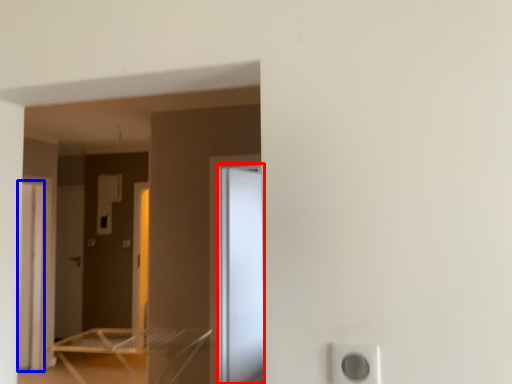
Question: Which of the following is the farthest to the observer, screen door (highlighted by a red box) or screen door (highlighted by a blue box)?

Choices:
 (A) screen door
 (B) screen door

Answer: (B)